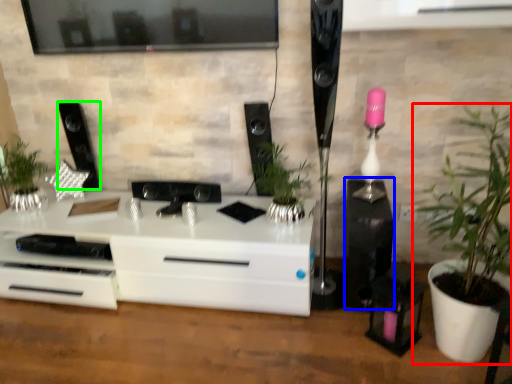
Question: Which object is the farthest from houseplant (highlighted by a red box)? Choose among these: speaker (highlighted by a blue box) or speaker (highlighted by a green box).

Choices:
 (A) speaker
 (B) speaker

Answer: (B)